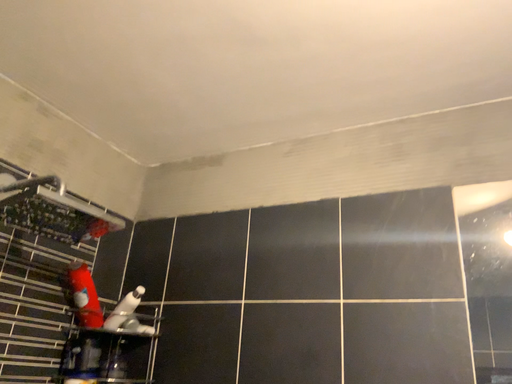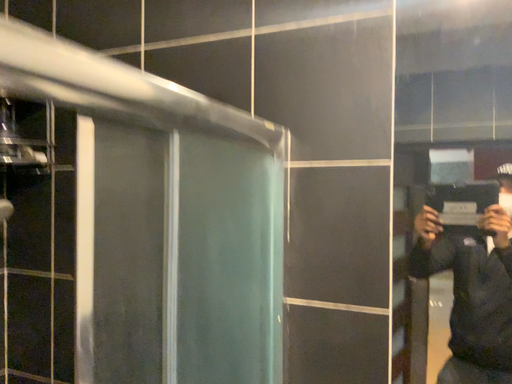
Question: Which way did the camera rotate in the video?

Choices:
 (A) rotated downward
 (B) rotated upward

Answer: (A)